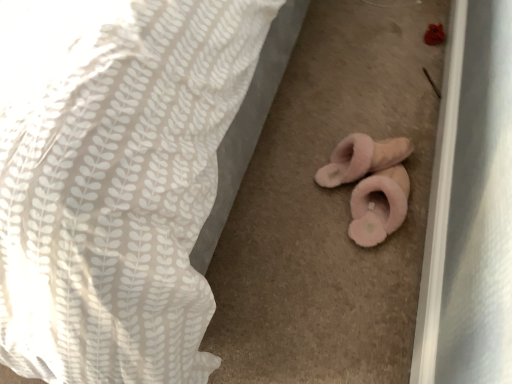
Question: Is pink fluffy slippers at lower center taller than white textured fabric at center?

Choices:
 (A) yes
 (B) no

Answer: (B)

Question: Is pink fluffy slippers at lower center not within white textured fabric at center?

Choices:
 (A) no
 (B) yes

Answer: (B)

Question: From a real-world perspective, is pink fluffy slippers at lower center under white textured fabric at center?

Choices:
 (A) no
 (B) yes

Answer: (B)

Question: Is pink fluffy slippers at lower center thinner than white textured fabric at center?

Choices:
 (A) no
 (B) yes

Answer: (B)

Question: Would you consider pink fluffy slippers at lower center to be distant from white textured fabric at center?

Choices:
 (A) yes
 (B) no

Answer: (B)

Question: Is pink fluffy slippers at lower center to the right of white textured fabric at center from the viewer's perspective?

Choices:
 (A) no
 (B) yes

Answer: (B)

Question: Is the position of white textured fabric at center more distant than that of pink fluffy slippers at lower center?

Choices:
 (A) yes
 (B) no

Answer: (B)

Question: From a real-world perspective, is white textured fabric at center below pink fluffy slippers at lower center?

Choices:
 (A) yes
 (B) no

Answer: (B)

Question: Is white textured fabric at center directly adjacent to pink fluffy slippers at lower center?

Choices:
 (A) no
 (B) yes

Answer: (A)

Question: Would you say pink fluffy slippers at lower center is part of white textured fabric at center's contents?

Choices:
 (A) yes
 (B) no

Answer: (B)

Question: Does white textured fabric at center have a greater width compared to pink fluffy slippers at lower center?

Choices:
 (A) no
 (B) yes

Answer: (B)

Question: From the image's perspective, is white textured fabric at center located beneath pink fluffy slippers at lower center?

Choices:
 (A) no
 (B) yes

Answer: (A)

Question: In the image, is pink fluffy slippers at lower center on the left side or the right side of white textured fabric at center?

Choices:
 (A) left
 (B) right

Answer: (B)